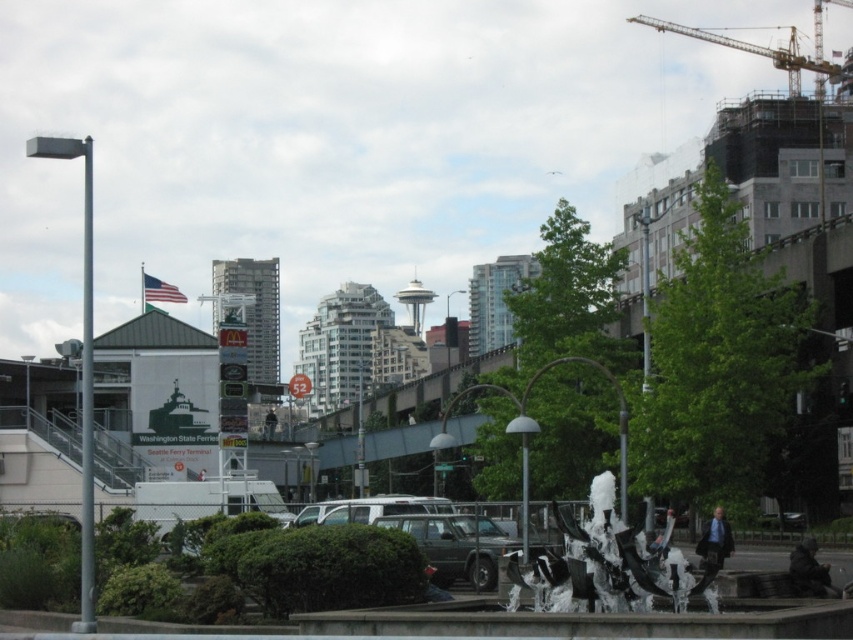
You are a pedestrian standing on the sidewalk near the fountain. You want to cross the street to reach the parking area behind the chain link fence. Is there a safe path between the metallic gray suv at center and the metallic construction crane at upper right?

The metallic gray suv at center is positioned under the metallic construction crane at upper right, so there is no safe path between them as the crane is directly above the SUV.

You are standing at the entrance of the urban area and see the white frothy sculpture at center. If you want to reach it as quickly as possible, should you walk towards the chain link fence on the left or the pedestrian overpass in the mid ground?

The white frothy sculpture at center is 33.32 meters away from the viewer. Since the sculpture is in the center of the scene, the shortest path would be to walk directly towards it rather than detouring around the chain link fence on the left or going through the pedestrian overpass in the mid ground. However, based on the given information, the distance is the same regardless of the path chosen. Please clarify the scene details for an accurate answer.

You are a delivery person needing to place a package between the white frothy sculpture at center and the metallic gray suv at center. The package requires a minimum of 6 meters of space to avoid damaging nearby objects. Based on the scene, is there enough space between them?

The white frothy sculpture at center is 5.41 meters from the metallic gray suv at center. Since the required space is 6 meters, there isn not enough space to safely place the package between them.